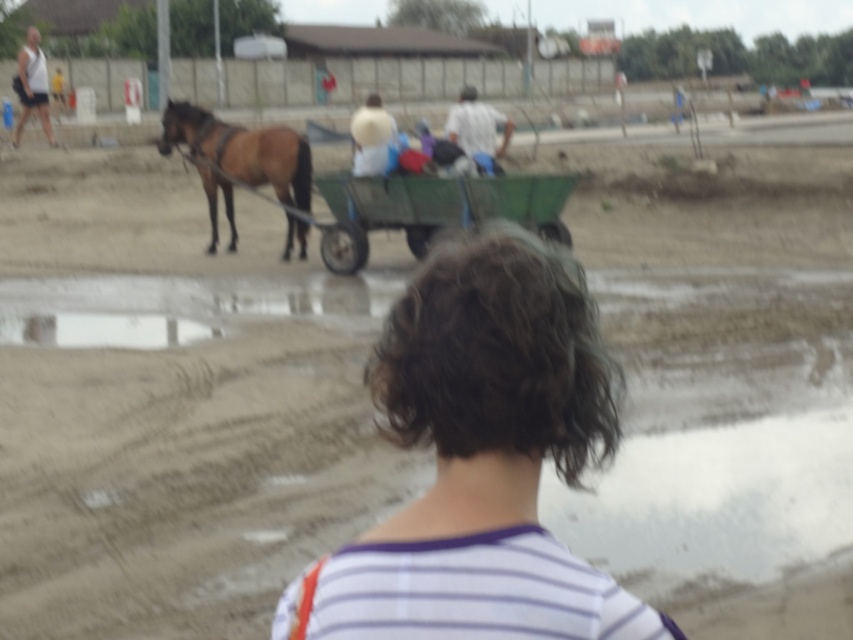
Does curly hair at center have a lesser height compared to brown glossy horse at upper left?

Indeed, curly hair at center has a lesser height compared to brown glossy horse at upper left.

I want to click on curly hair at center, so click(x=480, y=458).

Locate an element on the screen. curly hair at center is located at coordinates (480, 458).

Who is lower down, white cotton shirt at center or white fabric hat at center?

white fabric hat at center

Can you confirm if white cotton shirt at center is wider than white fabric hat at center?

In fact, white cotton shirt at center might be narrower than white fabric hat at center.

Is point (473, 129) positioned after point (360, 113)?

Yes, point (473, 129) is farther from viewer.

The height and width of the screenshot is (640, 853). I want to click on white cotton shirt at center, so click(x=477, y=129).

Where is `curly hair at center`? The image size is (853, 640). curly hair at center is located at coordinates (480, 458).

Who is more distant from viewer, (426, 340) or (361, 212)?

The point (361, 212) is behind.

Which is in front, point (454, 461) or point (332, 257)?

Point (454, 461) is more forward.

In order to click on curly hair at center in this screenshot , I will do tap(480, 458).